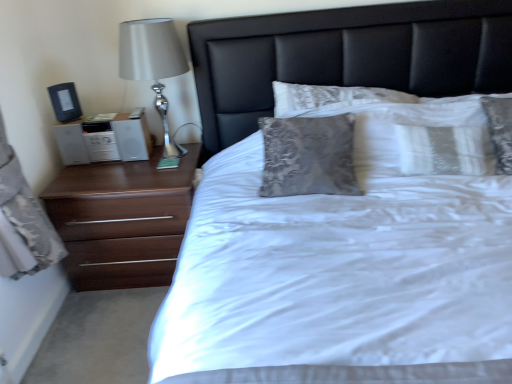
The width and height of the screenshot is (512, 384). Describe the element at coordinates (122, 219) in the screenshot. I see `brown wood chest of drawers at left` at that location.

At what (x,y) coordinates should I click in order to perform the action: click on white satin bed at center. Please return your answer as a coordinate pair (x, y). The image size is (512, 384). Looking at the image, I should click on (343, 271).

Where is `silver metallic table lamp at left`? silver metallic table lamp at left is located at coordinates (153, 64).

What is the approximate width of white glossy nightstand at left?

white glossy nightstand at left is 10.90 inches wide.

What do you see at coordinates (346, 56) in the screenshot?
I see `black leather headboard at center` at bounding box center [346, 56].

At what (x,y) coordinates should I click in order to perform the action: click on brown wood chest of drawers at left. Please return your answer as a coordinate pair (x, y). The height and width of the screenshot is (384, 512). Looking at the image, I should click on tap(122, 219).

Is the position of silver metallic table lamp at left more distant than that of brown wood chest of drawers at left?

No.

Considering the relative sizes of silver metallic table lamp at left and brown wood chest of drawers at left in the image provided, is silver metallic table lamp at left shorter than brown wood chest of drawers at left?

No, silver metallic table lamp at left is not shorter than brown wood chest of drawers at left.

Can you tell me how much silver metallic table lamp at left and brown wood chest of drawers at left differ in facing direction?

0.000222 degrees.

Is black leather headboard at center far away from white satin bed at center?

No, black leather headboard at center is not far from white satin bed at center.

From the image's perspective, who appears lower, black leather headboard at center or white satin bed at center?

white satin bed at center is shown below in the image.

Is black leather headboard at center aimed at white satin bed at center?

Yes, black leather headboard at center faces towards white satin bed at center.

Considering the sizes of black leather headboard at center and white satin bed at center in the image, is black leather headboard at center taller or shorter than white satin bed at center?

In the image, black leather headboard at center appears to be shorter than white satin bed at center.

What's the angular difference between brown wood chest of drawers at left and white satin bed at center's facing directions?

brown wood chest of drawers at left and white satin bed at center are facing 9.3e-05 degrees away from each other.

Considering the sizes of objects brown wood chest of drawers at left and white satin bed at center in the image provided, who is wider, brown wood chest of drawers at left or white satin bed at center?

white satin bed at center.

Considering the positions of objects brown wood chest of drawers at left and white satin bed at center in the image provided, who is more to the right, brown wood chest of drawers at left or white satin bed at center?

Positioned to the right is white satin bed at center.

Measure the distance between brown wood chest of drawers at left and white satin bed at center.

brown wood chest of drawers at left and white satin bed at center are 66.47 centimeters apart from each other.

Is black leather headboard at center thinner than white glossy nightstand at left?

No.

Considering their positions, is black leather headboard at center located in front of or behind white glossy nightstand at left?

black leather headboard at center is positioned closer to the viewer than white glossy nightstand at left.

Is black leather headboard at center oriented away from white glossy nightstand at left?

No, black leather headboard at center is not facing the opposite direction of white glossy nightstand at left.

From a real-world perspective, who is located higher, black leather headboard at center or white glossy nightstand at left?

black leather headboard at center.

Is silver metallic table lamp at left positioned with its back to white glossy nightstand at left?

silver metallic table lamp at left is not turned away from white glossy nightstand at left.

The image size is (512, 384). Identify the location of table lamp in front of the white glossy nightstand at left. (153, 64).

In the image, is silver metallic table lamp at left positioned in front of or behind white glossy nightstand at left?

Clearly, silver metallic table lamp at left is in front of white glossy nightstand at left.

Is silver metallic table lamp at left wider than white glossy nightstand at left?

Yes, silver metallic table lamp at left is wider than white glossy nightstand at left.

Is black leather headboard at center with silver metallic table lamp at left?

black leather headboard at center is not next to silver metallic table lamp at left, and they're not touching.

From the image's perspective, is black leather headboard at center below silver metallic table lamp at left?

Indeed, from the image's perspective, black leather headboard at center is shown beneath silver metallic table lamp at left.

Considering the relative sizes of black leather headboard at center and silver metallic table lamp at left in the image provided, is black leather headboard at center bigger than silver metallic table lamp at left?

Yes.

Is white glossy nightstand at left oriented towards brown wood chest of drawers at left?

No, white glossy nightstand at left is not aimed at brown wood chest of drawers at left.

Where is `chest of drawers below the white glossy nightstand at left (from the image's perspective)`? The width and height of the screenshot is (512, 384). chest of drawers below the white glossy nightstand at left (from the image's perspective) is located at coordinates (122, 219).

From a real-world perspective, is white glossy nightstand at left physically located above or below brown wood chest of drawers at left?

From a real-world perspective, white glossy nightstand at left is physically above brown wood chest of drawers at left.

Do you think white glossy nightstand at left is within brown wood chest of drawers at left, or outside of it?

white glossy nightstand at left cannot be found inside brown wood chest of drawers at left.

Image resolution: width=512 pixels, height=384 pixels. In order to click on the chest of drawers beneath the silver metallic table lamp at left (from a real-world perspective) in this screenshot , I will do [x=122, y=219].

Where is `bed on the right of black leather headboard at center`? This screenshot has height=384, width=512. bed on the right of black leather headboard at center is located at coordinates (343, 271).

Estimate the real-world distances between objects in this image. Which object is closer to white glossy nightstand at left, black leather headboard at center or silver metallic table lamp at left?

silver metallic table lamp at left.

From the image, which object appears to be nearer to white textured pillow at upper right, white satin bed at center or black leather headboard at center?

The object closer to white textured pillow at upper right is black leather headboard at center.

Which object lies nearer to the anchor point white glossy nightstand at left, white satin bed at center or white textured pillow at upper right?

white satin bed at center.

When comparing their distances from white satin bed at center, does brown wood chest of drawers at left or white glossy nightstand at left seem further?

Based on the image, white glossy nightstand at left appears to be further to white satin bed at center.

Based on their spatial positions, is white satin bed at center or silver metallic table lamp at left closer to white textured pillow at upper right?

Among the two, white satin bed at center is located nearer to white textured pillow at upper right.

Looking at this image, from the image, which object appears to be nearer to white glossy nightstand at left, brown wood chest of drawers at left or white satin bed at center?

Based on the image, brown wood chest of drawers at left appears to be nearer to white glossy nightstand at left.

Looking at the image, which one is located further to black leather headboard at center, white glossy nightstand at left or silver metallic table lamp at left?

Based on the image, white glossy nightstand at left appears to be further to black leather headboard at center.

When comparing their distances from brown wood chest of drawers at left, does white satin bed at center or silver metallic table lamp at left seem further?

silver metallic table lamp at left is positioned further to the anchor brown wood chest of drawers at left.

The width and height of the screenshot is (512, 384). I want to click on table lamp between white glossy nightstand at left and white textured pillow at upper right in the horizontal direction, so click(153, 64).

Where is `table lamp between brown wood chest of drawers at left and white textured pillow at upper right in the horizontal direction`? The width and height of the screenshot is (512, 384). table lamp between brown wood chest of drawers at left and white textured pillow at upper right in the horizontal direction is located at coordinates (153, 64).

At what (x,y) coordinates should I click in order to perform the action: click on table lamp located between white glossy nightstand at left and black leather headboard at center in the left-right direction. Please return your answer as a coordinate pair (x, y). The width and height of the screenshot is (512, 384). Looking at the image, I should click on (153, 64).

This screenshot has width=512, height=384. Identify the location of headboard between brown wood chest of drawers at left and white textured pillow at upper right in the horizontal direction. (346, 56).